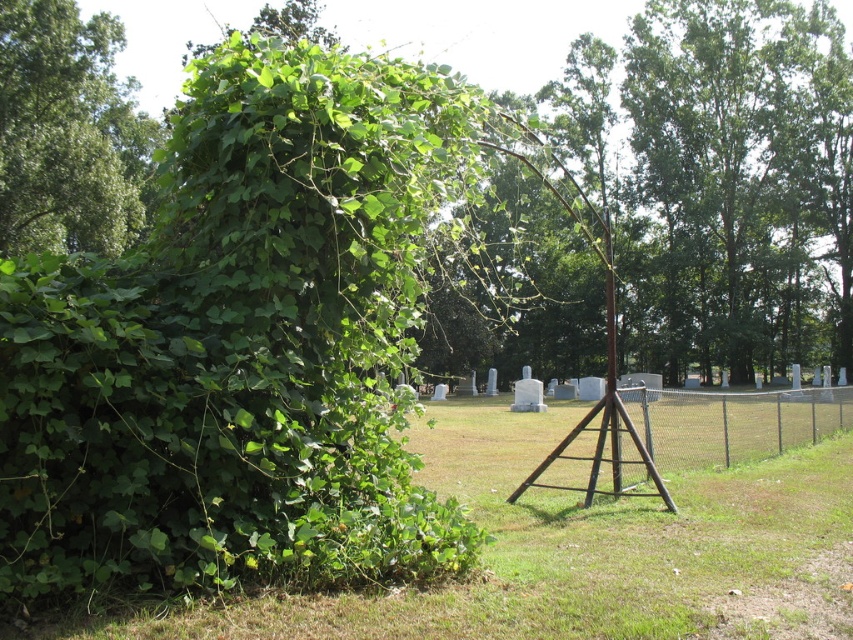
Question: From the image, what is the correct spatial relationship of green leafy tree at left in relation to chain link fence at right?

Choices:
 (A) right
 (B) left

Answer: (B)

Question: Estimate the real-world distances between objects in this image. Which object is closer to the green leafy tree at upper right?

Choices:
 (A) green leafy tree at left
 (B) green grass at center

Answer: (A)

Question: Considering the real-world distances, which object is closest to the chain link fence at right?

Choices:
 (A) green leafy tree at left
 (B) green leafy tree at upper right
 (C) green grass at center

Answer: (C)

Question: Is the position of green grass at center less distant than that of green leafy tree at left?

Choices:
 (A) no
 (B) yes

Answer: (B)

Question: Which point is farther to the camera?

Choices:
 (A) (825, 304)
 (B) (796, 440)

Answer: (A)

Question: Can you confirm if green grass at center is bigger than green leafy tree at upper right?

Choices:
 (A) no
 (B) yes

Answer: (A)